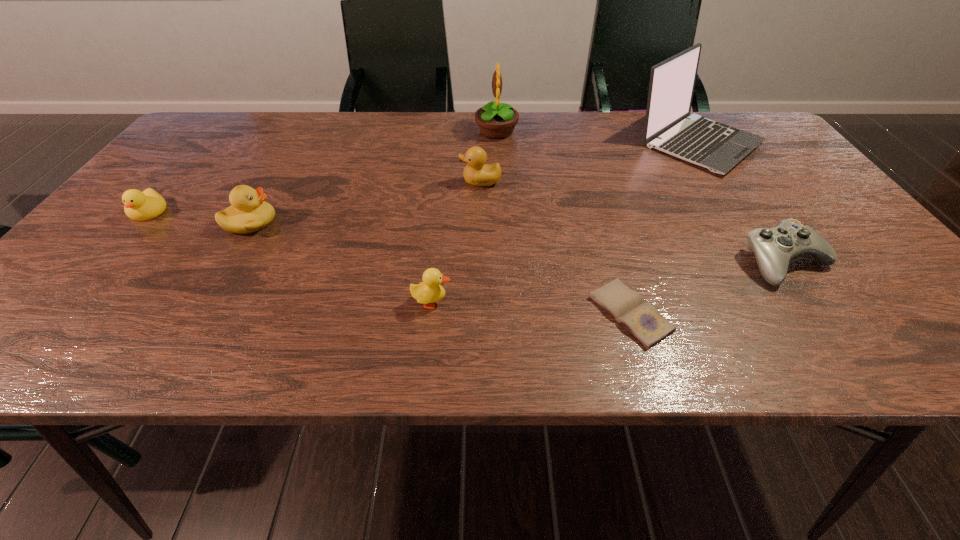
Identify the location of laptop_computer. (669, 127).

Locate an element on the screen. sunflower is located at coordinates (496, 120).

At what (x,y) coordinates should I click in order to perform the action: click on the rightmost duckling. Please return your answer as a coordinate pair (x, y). Looking at the image, I should click on point(477,173).

Where is `the second object from left to right`? The width and height of the screenshot is (960, 540). the second object from left to right is located at coordinates (248, 213).

Where is `the second duckling from right to left`? The width and height of the screenshot is (960, 540). the second duckling from right to left is located at coordinates (429, 291).

I want to click on the nearest duckling, so click(x=429, y=291).

Find the location of `control`. control is located at coordinates (774, 248).

In order to click on the shortest duckling in this screenshot , I will do `click(140, 206)`.

Find the location of `the leftmost object`. the leftmost object is located at coordinates (140, 206).

I want to click on the third object from right to left, so click(641, 319).